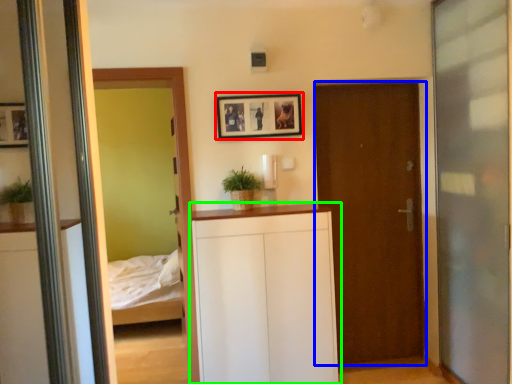
Question: Based on their relative distances, which object is farther from picture frame (highlighted by a red box)? Choose from door (highlighted by a blue box) and dresser (highlighted by a green box).

Choices:
 (A) door
 (B) dresser

Answer: (B)